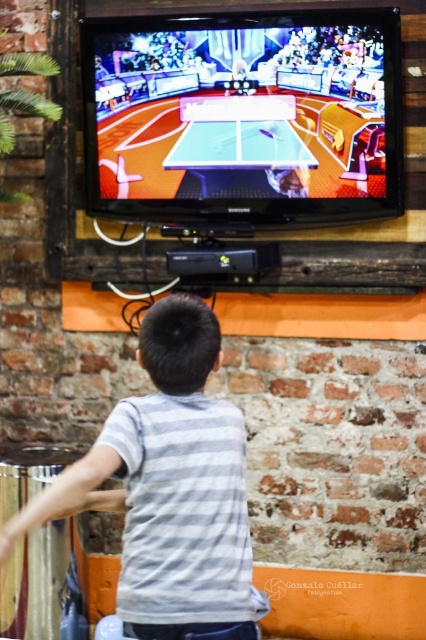
Question: Which of the following is the farthest from the observer?

Choices:
 (A) (175, 378)
 (B) (92, 26)

Answer: (B)

Question: Is shiny plastic table at upper center to the right of gray striped shirt at center from the viewer's perspective?

Choices:
 (A) yes
 (B) no

Answer: (A)

Question: Does shiny plastic table at upper center have a smaller size compared to gray striped shirt at center?

Choices:
 (A) no
 (B) yes

Answer: (A)

Question: Which point appears farthest from the camera in this image?

Choices:
 (A) (178, 392)
 (B) (219, 65)

Answer: (B)

Question: Is shiny plastic table at upper center bigger than gray striped shirt at center?

Choices:
 (A) yes
 (B) no

Answer: (A)